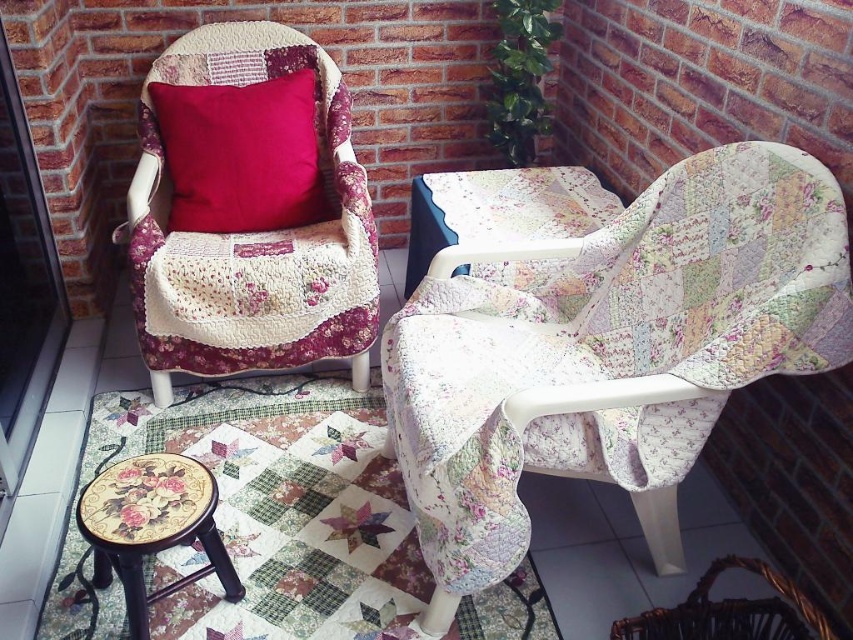
Question: Where is floral patchwork armchair at left located in relation to matte red cushion at upper left in the image?

Choices:
 (A) right
 (B) left

Answer: (A)

Question: Is floral patchwork armchair at left thinner than floral fabric stool at lower left?

Choices:
 (A) yes
 (B) no

Answer: (B)

Question: Which object is positioned farthest from the floral fabric stool at lower left?

Choices:
 (A) floral patchwork armchair at center
 (B) floral patchwork armchair at left
 (C) matte red cushion at upper left

Answer: (C)

Question: Which point is closer to the camera taking this photo?

Choices:
 (A) (164, 595)
 (B) (247, 214)
 (C) (152, 324)
 (D) (502, 387)

Answer: (A)

Question: Is floral patchwork armchair at center above floral fabric stool at lower left?

Choices:
 (A) no
 (B) yes

Answer: (B)

Question: Which object appears farthest from the camera in this image?

Choices:
 (A) matte red cushion at upper left
 (B) floral fabric stool at lower left
 (C) floral patchwork armchair at left
 (D) floral patchwork armchair at center

Answer: (A)